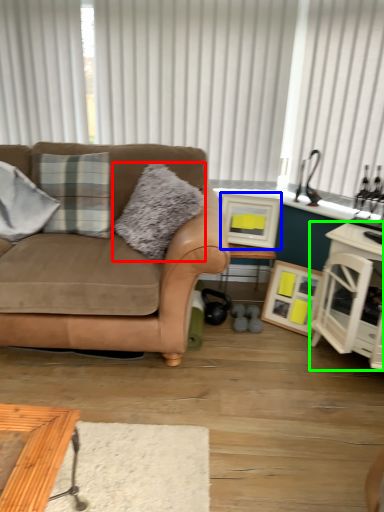
Question: Which object is the farthest from pillow (highlighted by a red box)? Choose among these: picture frame (highlighted by a blue box) or cabinetry (highlighted by a green box).

Choices:
 (A) picture frame
 (B) cabinetry

Answer: (B)